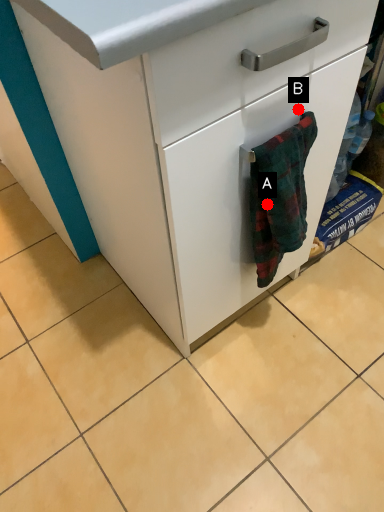
Question: Two points are circled on the image, labeled by A and B beside each circle. Which point is closer to the camera taking this photo?

Choices:
 (A) A is closer
 (B) B is closer

Answer: (B)